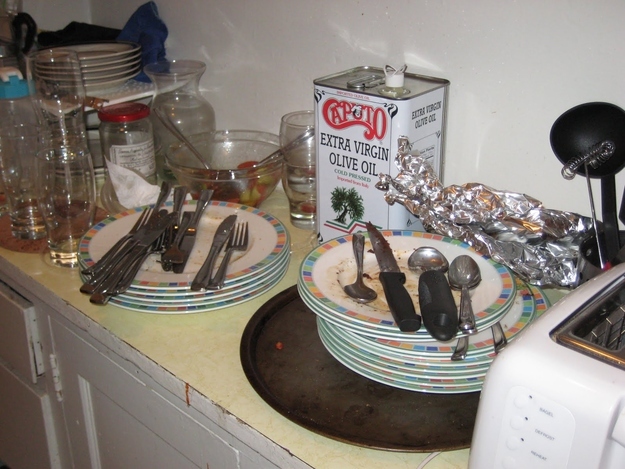
Locate an element on the screen. The height and width of the screenshot is (469, 625). cutlery is located at coordinates (222, 260).